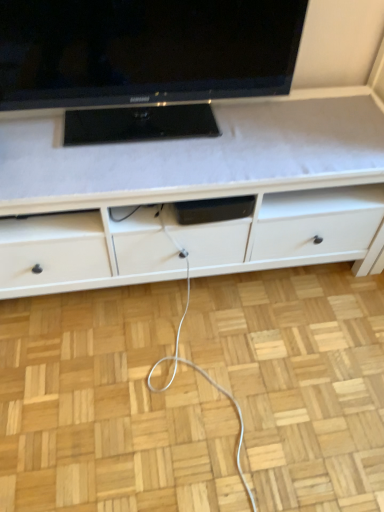
Where is `vacant space to the right of black glossy tv at upper center`? The height and width of the screenshot is (512, 384). vacant space to the right of black glossy tv at upper center is located at coordinates (283, 132).